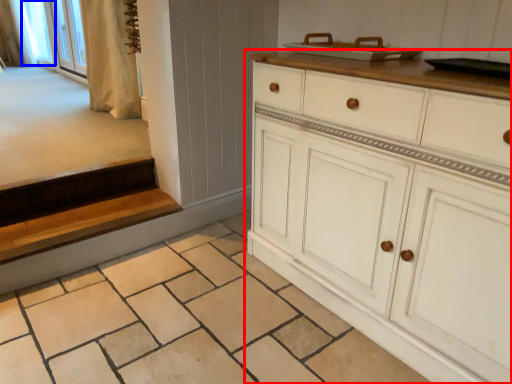
Question: Which object is closer to the camera taking this photo, chest of drawers (highlighted by a red box) or window screen (highlighted by a blue box)?

Choices:
 (A) chest of drawers
 (B) window screen

Answer: (A)